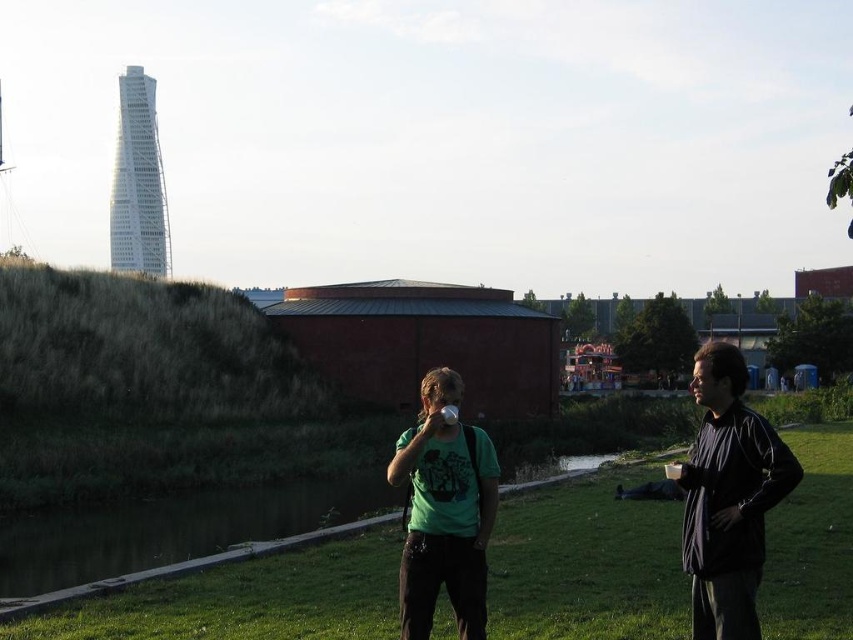
You are a photographer trying to capture a candid shot of the two people in the scene. Since you want to ensure the green grass at center and the green matte shirt at center are clearly visible in the photo, which one should you focus on first?

The green grass at center is shorter than the green matte shirt at center, so you should focus on the green matte shirt at center first to ensure both are in focus.

You are standing at the origin point in the image. Which direction should you walk to reach the green grass at center?

The green grass at center is located at coordinates point (x=587, y=564), so you should walk towards the direction of the point to reach it.